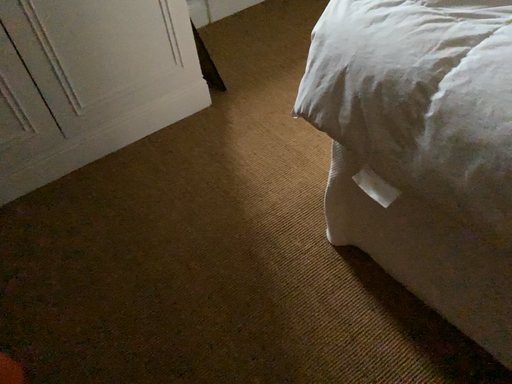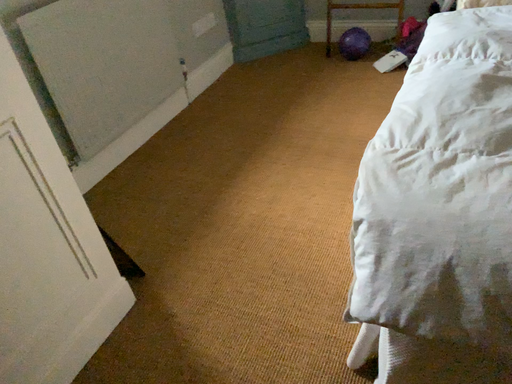
Question: How did the camera likely rotate when shooting the video?

Choices:
 (A) rotated left
 (B) rotated right

Answer: (B)